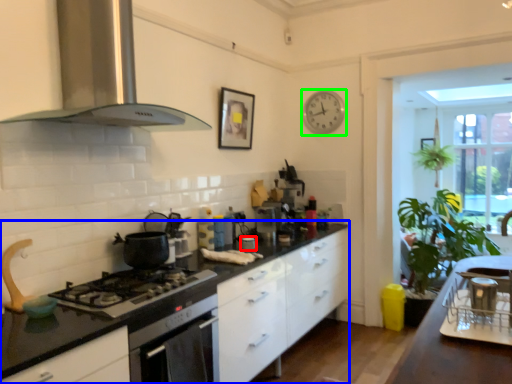
Question: Which object is the closest to the appliance (highlighted by a red box)? Choose among these: countertop (highlighted by a blue box) or clock (highlighted by a green box).

Choices:
 (A) countertop
 (B) clock

Answer: (A)